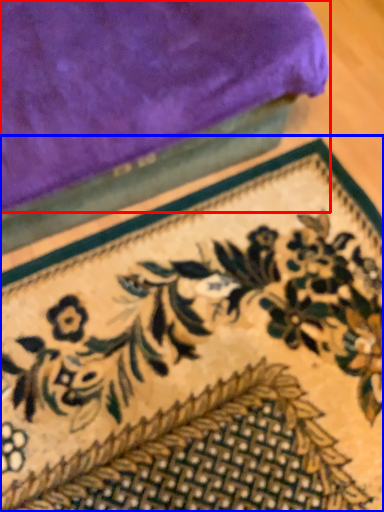
Question: Which of the following is the closest to the observer, towel (highlighted by a red box) or mat (highlighted by a blue box)?

Choices:
 (A) towel
 (B) mat

Answer: (A)